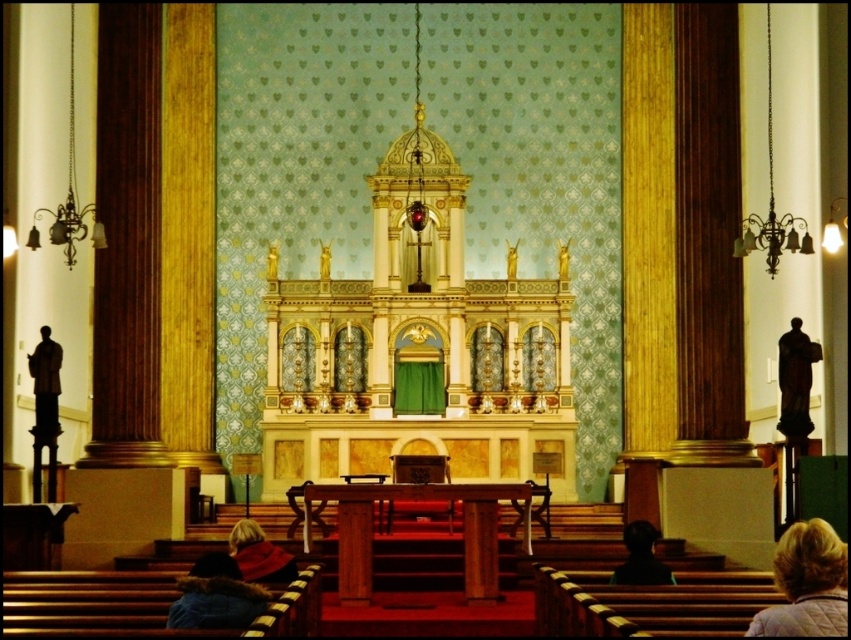
The width and height of the screenshot is (851, 640). What do you see at coordinates (806, 582) in the screenshot?
I see `blonde hair at lower right` at bounding box center [806, 582].

The height and width of the screenshot is (640, 851). I want to click on blonde hair at lower right, so click(x=806, y=582).

Which is behind, point (840, 577) or point (44, 333)?

Positioned behind is point (44, 333).

Identify the location of blonde hair at lower right. (806, 582).

Is blonde hair at lower right closer to the viewer compared to dark hair at lower center?

Yes, blonde hair at lower right is in front of dark hair at lower center.

The height and width of the screenshot is (640, 851). Find the location of `blonde hair at lower right`. blonde hair at lower right is located at coordinates (806, 582).

Which is in front, point (824, 540) or point (641, 538)?

Positioned in front is point (824, 540).

Image resolution: width=851 pixels, height=640 pixels. Find the location of `blonde hair at lower right`. blonde hair at lower right is located at coordinates (806, 582).

Measure the distance between brown fur coat at lower left and velvet red cape at lower center.

brown fur coat at lower left and velvet red cape at lower center are 7.87 meters apart.

Can you confirm if brown fur coat at lower left is taller than velvet red cape at lower center?

Incorrect, brown fur coat at lower left's height is not larger of velvet red cape at lower center's.

The width and height of the screenshot is (851, 640). Find the location of `brown fur coat at lower left`. brown fur coat at lower left is located at coordinates (215, 596).